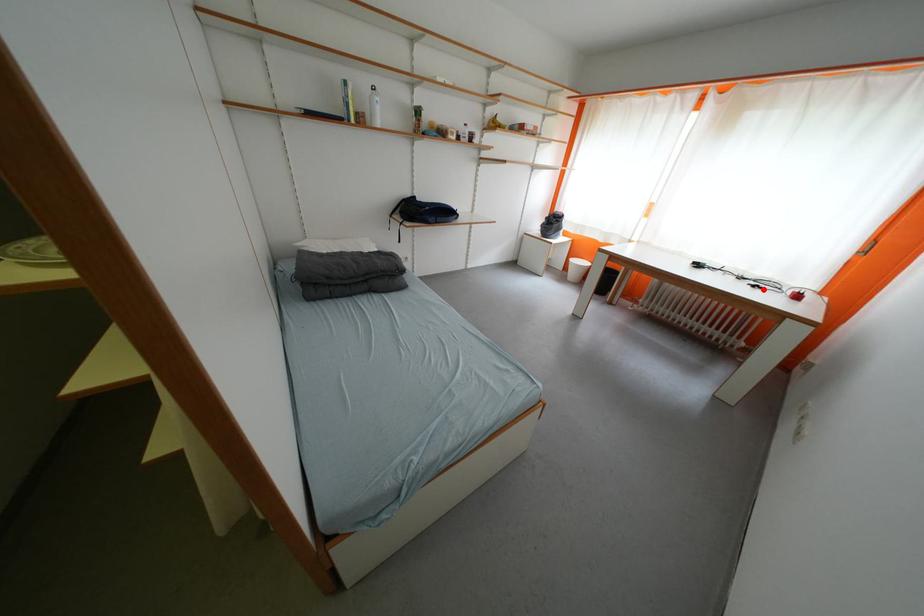
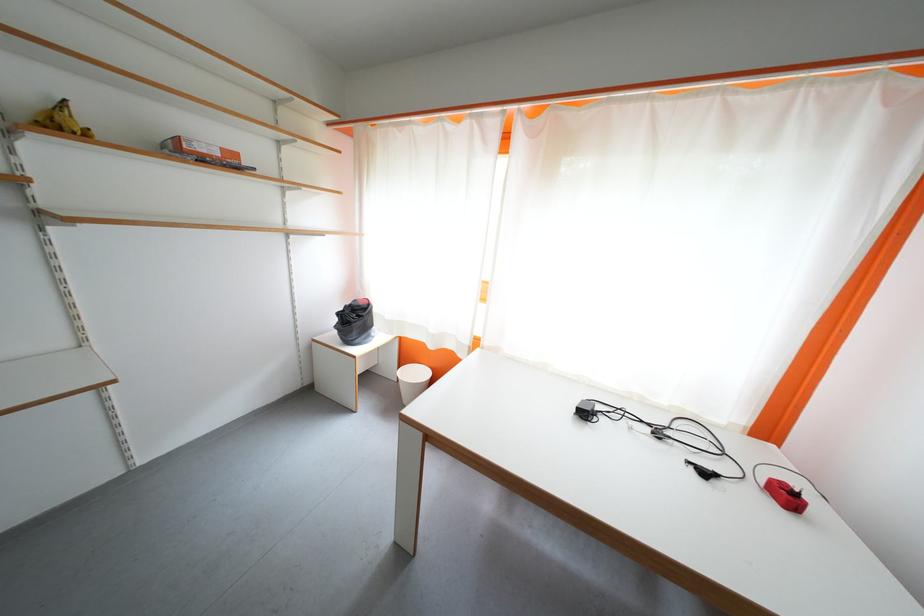
The point at the highlighted location is marked in the first image. Where is the corresponding point in the second image?

(713, 477)